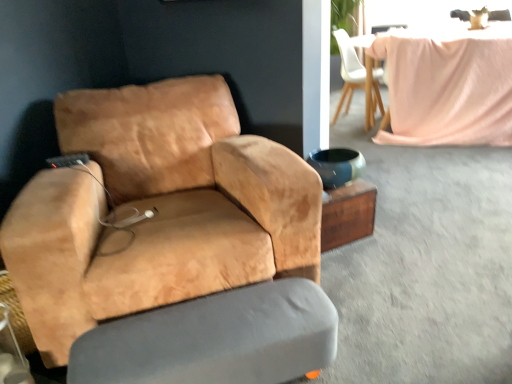
Question: Should I look upward or downward to see suede tan chair at left, placed as the first chair when sorted from front to back?

Choices:
 (A) up
 (B) down

Answer: (A)

Question: From the image's perspective, is white matte chair at upper center, which ranks as the 2th chair in left-to-right order, located beneath wooden side table at center?

Choices:
 (A) no
 (B) yes

Answer: (A)

Question: Is white matte chair at upper center, which ranks as the second chair in front-to-back order, thinner than wooden side table at center?

Choices:
 (A) yes
 (B) no

Answer: (B)

Question: Is white matte chair at upper center, the 1th chair when ordered from back to front, facing away from wooden side table at center?

Choices:
 (A) yes
 (B) no

Answer: (B)

Question: Considering the relative sizes of white matte chair at upper center, the 1th chair when ordered from top to bottom, and wooden side table at center in the image provided, is white matte chair at upper center, the 1th chair when ordered from top to bottom, smaller than wooden side table at center?

Choices:
 (A) yes
 (B) no

Answer: (B)

Question: Considering the relative sizes of white matte chair at upper center, which ranks as the second chair in front-to-back order, and wooden side table at center in the image provided, is white matte chair at upper center, which ranks as the second chair in front-to-back order, taller than wooden side table at center?

Choices:
 (A) no
 (B) yes

Answer: (B)

Question: Does white matte chair at upper center, which appears as the 2th chair when ordered from the bottom, lie behind wooden side table at center?

Choices:
 (A) no
 (B) yes

Answer: (B)

Question: Can you confirm if suede tan chair at left, placed as the first chair when sorted from front to back, is smaller than wooden side table at center?

Choices:
 (A) yes
 (B) no

Answer: (B)

Question: Is suede tan chair at left, acting as the 1th chair starting from the left, aimed at wooden side table at center?

Choices:
 (A) yes
 (B) no

Answer: (B)

Question: From a real-world perspective, does suede tan chair at left, acting as the 1th chair starting from the left, stand above wooden side table at center?

Choices:
 (A) no
 (B) yes

Answer: (B)

Question: Considering the relative sizes of suede tan chair at left, the 1th chair when ordered from bottom to top, and wooden side table at center in the image provided, is suede tan chair at left, the 1th chair when ordered from bottom to top, taller than wooden side table at center?

Choices:
 (A) no
 (B) yes

Answer: (B)

Question: Can you confirm if suede tan chair at left, the second chair positioned from the back, is shorter than wooden side table at center?

Choices:
 (A) yes
 (B) no

Answer: (B)

Question: Is wooden side table at center completely or partially inside suede tan chair at left, the second chair positioned from the back?

Choices:
 (A) yes
 (B) no

Answer: (B)

Question: Does suede tan chair at left, acting as the 1th chair starting from the left, appear on the right side of gray fabric swivel chair at lower center?

Choices:
 (A) no
 (B) yes

Answer: (A)